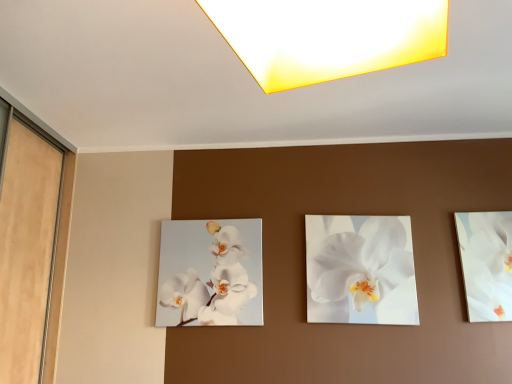
Question: Is matte yellow square at upper center with white glossy orchid at right?

Choices:
 (A) no
 (B) yes

Answer: (A)

Question: From the image's perspective, is matte yellow square at upper center located above white glossy orchid at right?

Choices:
 (A) no
 (B) yes

Answer: (B)

Question: Is matte yellow square at upper center turned away from white glossy orchid at right?

Choices:
 (A) no
 (B) yes

Answer: (B)

Question: Does matte yellow square at upper center have a greater height compared to white glossy orchid at right?

Choices:
 (A) no
 (B) yes

Answer: (A)

Question: Is matte yellow square at upper center thinner than white glossy orchid at right?

Choices:
 (A) no
 (B) yes

Answer: (A)

Question: In terms of width, does matte yellow square at upper center look wider or thinner when compared to white glossy orchid at center, which is the 1th flower in right-to-left order?

Choices:
 (A) thin
 (B) wide

Answer: (B)

Question: Is matte yellow square at upper center inside or outside of white glossy orchid at center, which is the 1th flower in right-to-left order?

Choices:
 (A) outside
 (B) inside

Answer: (A)

Question: From the image's perspective, relative to white glossy orchid at center, which is the 1th flower in right-to-left order, is matte yellow square at upper center above or below?

Choices:
 (A) below
 (B) above

Answer: (B)

Question: In terms of height, does matte yellow square at upper center look taller or shorter compared to white glossy orchid at center, the second flower from the left?

Choices:
 (A) short
 (B) tall

Answer: (A)

Question: In terms of height, does white glossy orchid at center, the first flower when ordered from left to right, look taller or shorter compared to white glossy orchid at right?

Choices:
 (A) short
 (B) tall

Answer: (A)

Question: Is white glossy orchid at center, which is counted as the second flower, starting from the right, spatially inside white glossy orchid at right, or outside of it?

Choices:
 (A) inside
 (B) outside

Answer: (B)

Question: Considering the positions of white glossy orchid at center, the first flower when ordered from left to right, and white glossy orchid at right in the image, is white glossy orchid at center, the first flower when ordered from left to right, wider or thinner than white glossy orchid at right?

Choices:
 (A) thin
 (B) wide

Answer: (A)

Question: From a real-world perspective, is white glossy orchid at center, the first flower when ordered from left to right, positioned above or below white glossy orchid at right?

Choices:
 (A) above
 (B) below

Answer: (B)

Question: In the image, is white glossy orchid at right positioned in front of or behind matte yellow square at upper center?

Choices:
 (A) front
 (B) behind

Answer: (B)

Question: Is point (480, 307) positioned closer to the camera than point (356, 69)?

Choices:
 (A) closer
 (B) farther

Answer: (B)